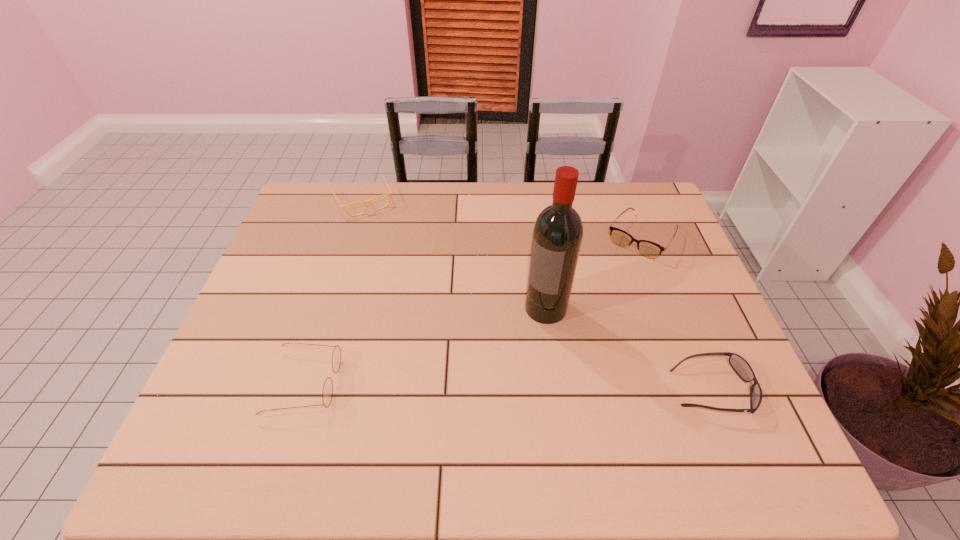
At what (x,y) coordinates should I click in order to perform the action: click on the nearest spectacles. Please return your answer as a coordinate pair (x, y). This screenshot has height=540, width=960. Looking at the image, I should click on [x=327, y=393].

Locate an element on the screen. This screenshot has width=960, height=540. sunglasses is located at coordinates (742, 368).

This screenshot has width=960, height=540. I want to click on the tallest object, so click(558, 230).

Locate an element on the screen. wine bottle is located at coordinates (558, 230).

You are a GUI agent. You are given a task and a screenshot of the screen. Output one action in this format:
    pyautogui.click(x=<x>, y=<y>)
    Task: Click on the rightmost spectacles
    Image resolution: width=960 pixels, height=540 pixels.
    Given the screenshot: What is the action you would take?
    pyautogui.click(x=648, y=249)

You are a GUI agent. You are given a task and a screenshot of the screen. Output one action in this format:
    pyautogui.click(x=<x>, y=<y>)
    Task: Click on the vacant space situated 0.220m on the temples of the nearest spectacles
    
    Given the screenshot: What is the action you would take?
    pyautogui.click(x=435, y=383)

Where is `free spot located 0.310m on the label of the tallest object`? Image resolution: width=960 pixels, height=540 pixels. free spot located 0.310m on the label of the tallest object is located at coordinates (467, 414).

This screenshot has height=540, width=960. What are the coordinates of `vacant space situated 0.100m on the label of the tallest object` in the screenshot? It's located at (516, 348).

At what (x,y) coordinates should I click in order to perform the action: click on blank space located on the label of the tallest object. Please return your answer as a coordinate pair (x, y). Image resolution: width=960 pixels, height=540 pixels. Looking at the image, I should click on [476, 400].

Locate an element on the screen. vacant space situated on the face of the rightmost spectacles is located at coordinates (574, 334).